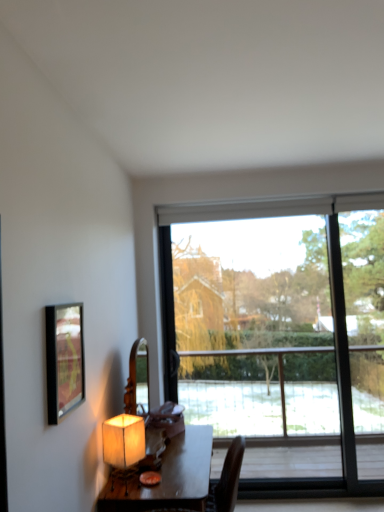
Question: Is matte beige lampshade at lower left bigger or smaller than transparent glass window at center?

Choices:
 (A) small
 (B) big

Answer: (A)

Question: From the image's perspective, is matte beige lampshade at lower left above or below transparent glass window at center?

Choices:
 (A) above
 (B) below

Answer: (B)

Question: Estimate the real-world distances between objects in this image. Which object is closer to the transparent glass window at center?

Choices:
 (A) wooden table at center
 (B) matte beige lampshade at lower left
 (C) metallic gold picture frame at upper left

Answer: (A)

Question: Which object is the closest to the transparent glass window at center?

Choices:
 (A) metallic gold picture frame at upper left
 (B) wooden table at center
 (C) matte beige lampshade at lower left

Answer: (B)